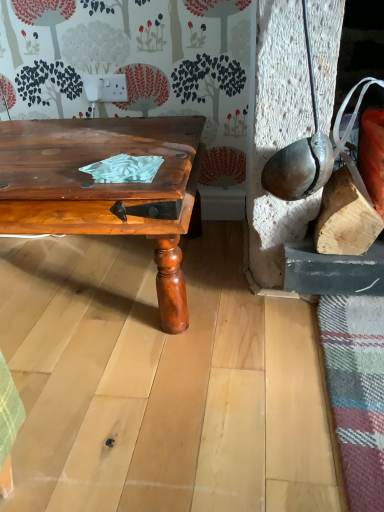
From the picture: What is the approximate width of wooden polished coffee table at left?

wooden polished coffee table at left is 24.17 inches in width.

The width and height of the screenshot is (384, 512). I want to click on wooden polished coffee table at left, so click(107, 189).

What do you see at coordinates (107, 189) in the screenshot? This screenshot has height=512, width=384. I see `wooden polished coffee table at left` at bounding box center [107, 189].

Where is `wooden polished coffee table at left`? wooden polished coffee table at left is located at coordinates (107, 189).